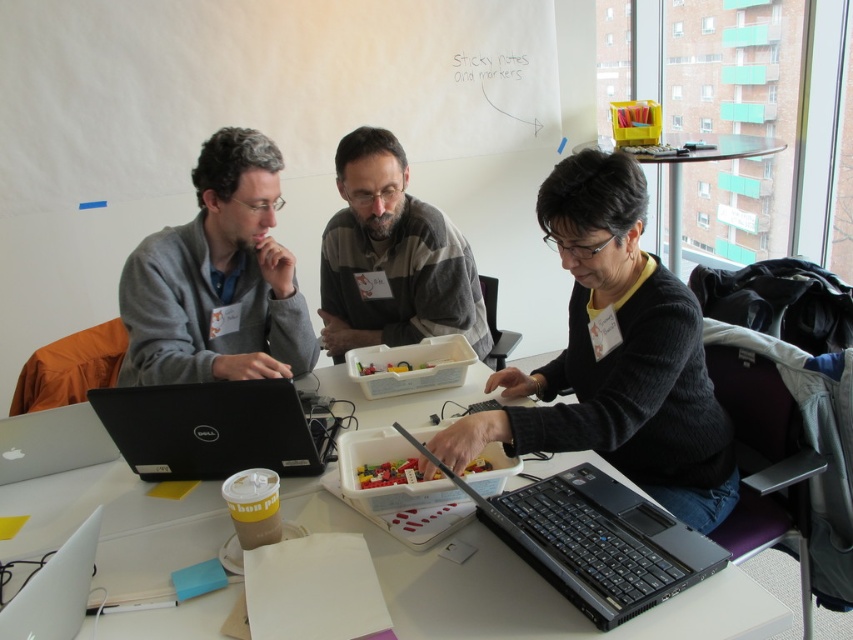
Is point (228, 461) farther from viewer compared to point (715, 148)?

No, it is not.

Looking at this image, between black matte laptop at left and clear glass table at upper right, which one has more height?

clear glass table at upper right is taller.

The height and width of the screenshot is (640, 853). Find the location of `black matte laptop at left`. black matte laptop at left is located at coordinates (218, 428).

Can you confirm if white matte laptop at lower left is bigger than clear glass table at upper right?

Actually, white matte laptop at lower left might be smaller than clear glass table at upper right.

Between white matte laptop at lower left and clear glass table at upper right, which one is positioned higher?

clear glass table at upper right is above.

Who is more forward, (47, 586) or (679, 259)?

Point (47, 586)

What are the coordinates of `white matte laptop at lower left` in the screenshot? It's located at (55, 589).

Is black matte laptop at center taller than white matte laptop at lower left?

Correct, black matte laptop at center is much taller as white matte laptop at lower left.

What do you see at coordinates (593, 540) in the screenshot? I see `black matte laptop at center` at bounding box center [593, 540].

You are a GUI agent. You are given a task and a screenshot of the screen. Output one action in this format:
    pyautogui.click(x=<x>, y=<y>)
    Task: Click on the black matte laptop at center
    
    Given the screenshot: What is the action you would take?
    pyautogui.click(x=593, y=540)